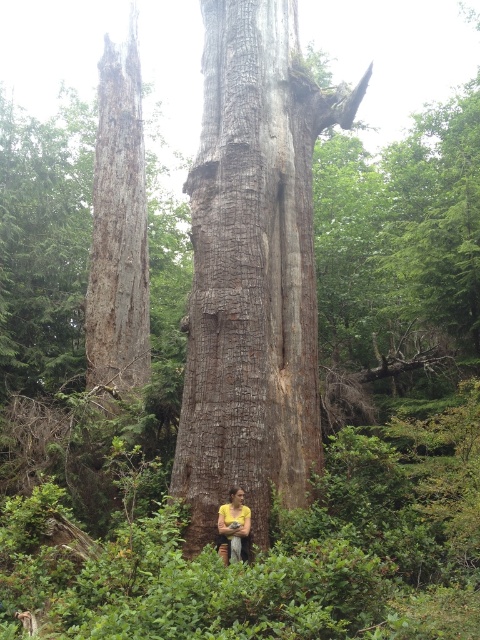
You are a botanist standing at the center of the forest. You need to locate the rough bark tree trunk at center. Based on the coordinates provided, can you determine its exact position relative to your current location?

The rough bark tree trunk at center is located at coordinates point (251, 272), which means it is slightly to the right and above your current position at the center of the forest.

You are standing in the forest and want to take a photo of the yellow fabric person at center. The rough bark tree trunk at center is blocking your view. Can you move to the side to get a clear shot without the tree trunk in the way?

The rough bark tree trunk at center is closer to you than the yellow fabric person at center. To get a clear shot of the yellow fabric person at center, you can move to the side so the tree trunk is no longer blocking the view.